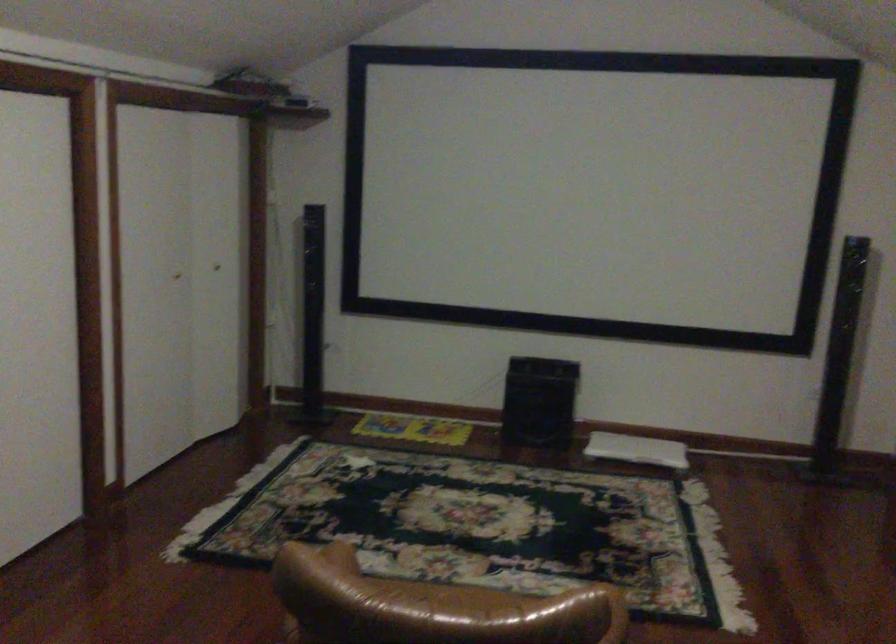
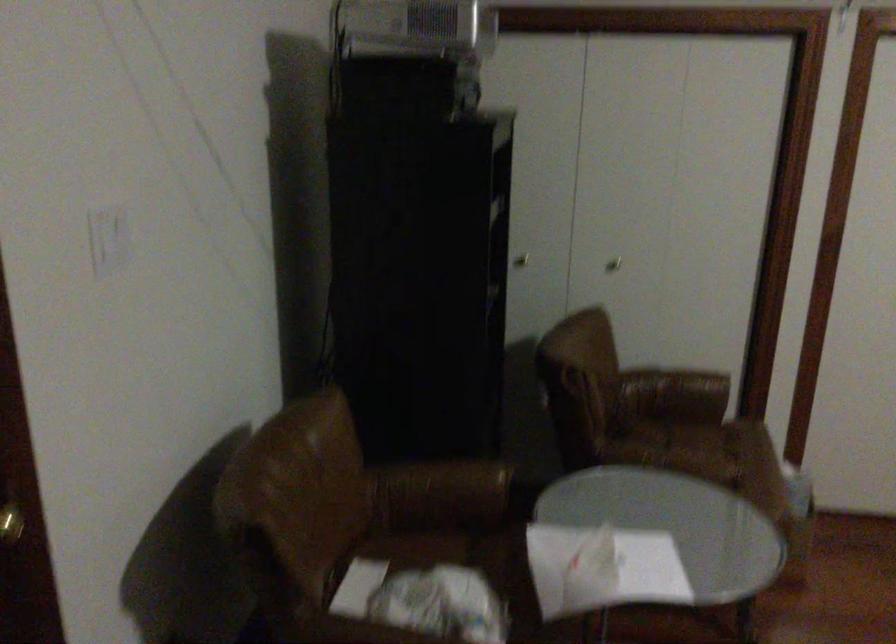
Question: The camera is either moving clockwise (left) or counter-clockwise (right) around the object. The first image is from the beginning of the video and the second image is from the end. Is the camera moving left or right when shooting the video?

Choices:
 (A) Left
 (B) Right

Answer: (B)